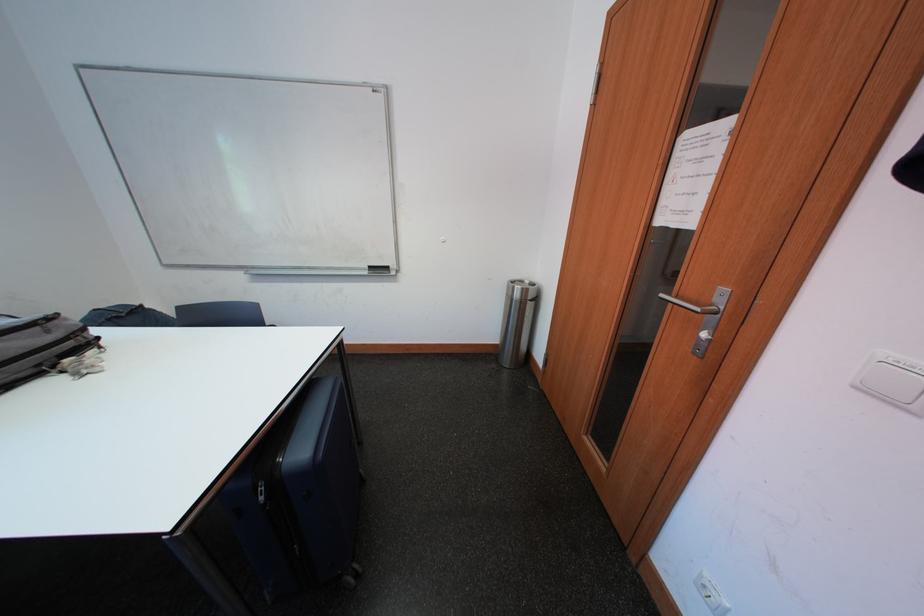
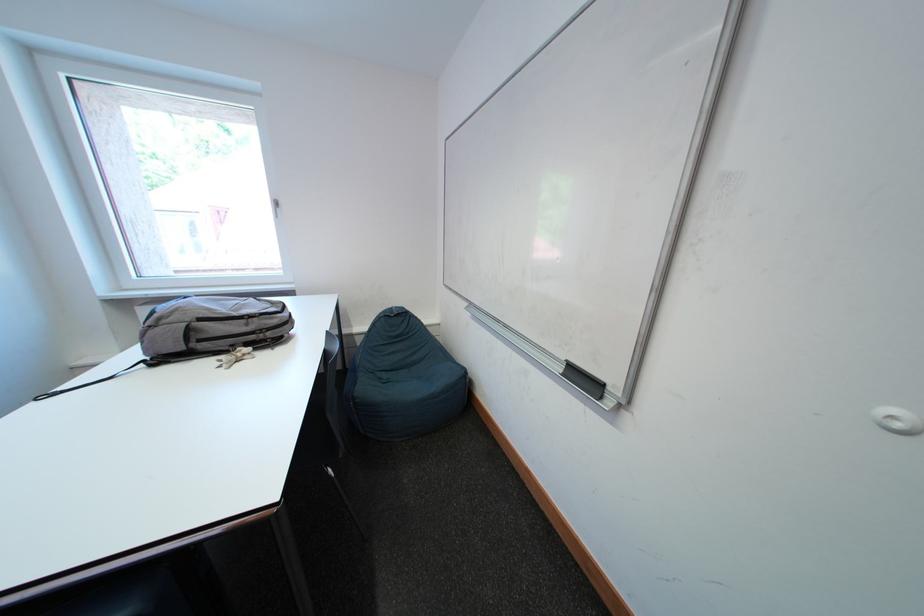
Locate, in the second image, the point that corresponds to (x=45, y=333) in the first image.

(252, 325)